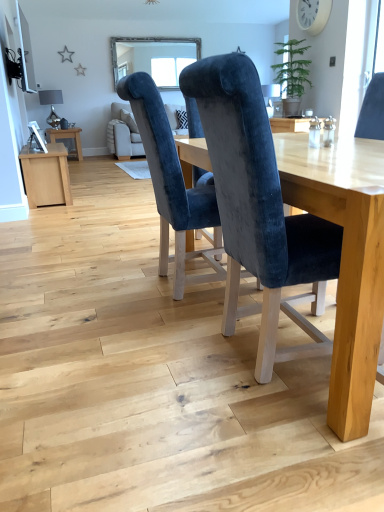
Question: From the image's perspective, is clear glass window at upper center located above or below velvet blue chair at center, the first chair positioned from the right?

Choices:
 (A) above
 (B) below

Answer: (A)

Question: Visually, is clear glass window at upper center positioned to the left or to the right of velvet blue chair at center, the second chair in the left-to-right sequence?

Choices:
 (A) right
 (B) left

Answer: (B)

Question: Which is nearer to the clear glass window at upper center?

Choices:
 (A) velvet blue chair at center, the second chair from the right
 (B) wooden side table at left
 (C) velvet blue chair at center, the second chair in the left-to-right sequence

Answer: (B)

Question: Which object is the farthest from the velvet blue chair at center, the first chair positioned from the right?

Choices:
 (A) clear glass window at upper center
 (B) velvet blue chair at center, the second chair from the right
 (C) wooden side table at left

Answer: (A)